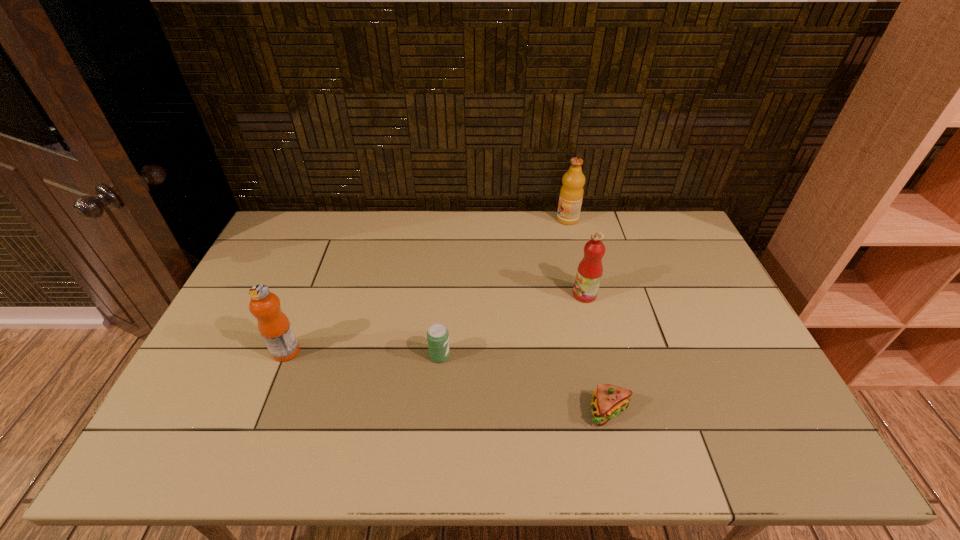
Where is `the closest object to the nearest fruit juice`? This screenshot has height=540, width=960. the closest object to the nearest fruit juice is located at coordinates (437, 335).

In order to click on the third closest object to the second nearest fruit juice in this screenshot , I will do `click(437, 335)`.

Locate which fruit juice is the second closest to the soda. Please provide its 2D coordinates. Your answer should be formatted as a tuple, i.e. [(x, y)], where the tuple contains the x and y coordinates of a point satisfying the conditions above.

[(590, 269)]

In order to click on fruit juice that is the second closest to the farthest fruit juice in this screenshot , I will do `click(274, 326)`.

I want to click on vacant space that satisfies the following two spatial constraints: 1. on the front label of the second farthest object; 2. on the front side of the nearest object, so click(x=613, y=411).